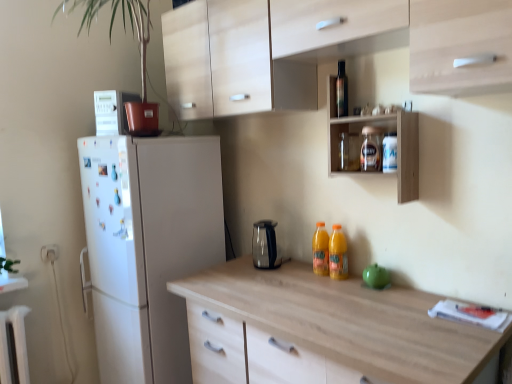
Question: Is sleek metallic kettle at center, the 2th appliance positioned from the front, wider or thinner than green matte apple at center, placed as the third appliance when sorted from left to right?

Choices:
 (A) wide
 (B) thin

Answer: (A)

Question: Is sleek metallic kettle at center, acting as the 2th appliance starting from the bottom, in front of or behind green matte apple at center, positioned as the 1th appliance in bottom-to-top order, in the image?

Choices:
 (A) front
 (B) behind

Answer: (B)

Question: Which is farther from the sleek metallic kettle at center, the 2th appliance positioned from the front?

Choices:
 (A) shiny dark glass bottle at upper center, placed as the first bottle when sorted from top to bottom
 (B) green matte plant at upper left
 (C) wooden shelf at upper center
 (D) clear plastic bottle at upper right, which appears as the second bottle when ordered from the bottom
 (E) white plastic electric outlet at lower left

Answer: (E)

Question: Estimate the real-world distances between objects in this image. Which object is closer to the shiny dark glass bottle at upper center, the 4th bottle when ordered from bottom to top?

Choices:
 (A) green matte apple at center, positioned as the 1th appliance in bottom-to-top order
 (B) transparent glass jar at upper center, the third bottle positioned from the bottom
 (C) white plastic electric outlet at lower left
 (D) wooden shelf at upper center
 (E) green matte plant at upper left

Answer: (B)